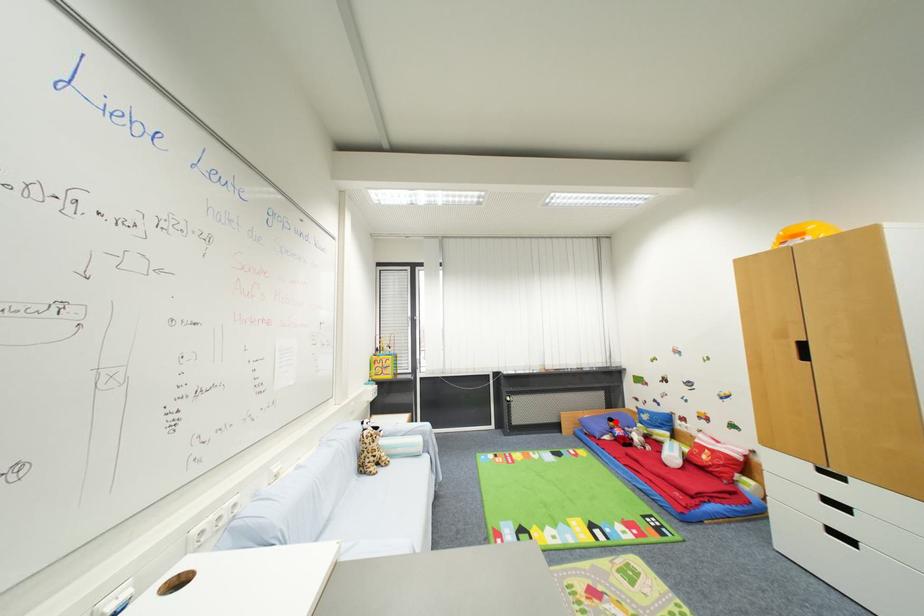
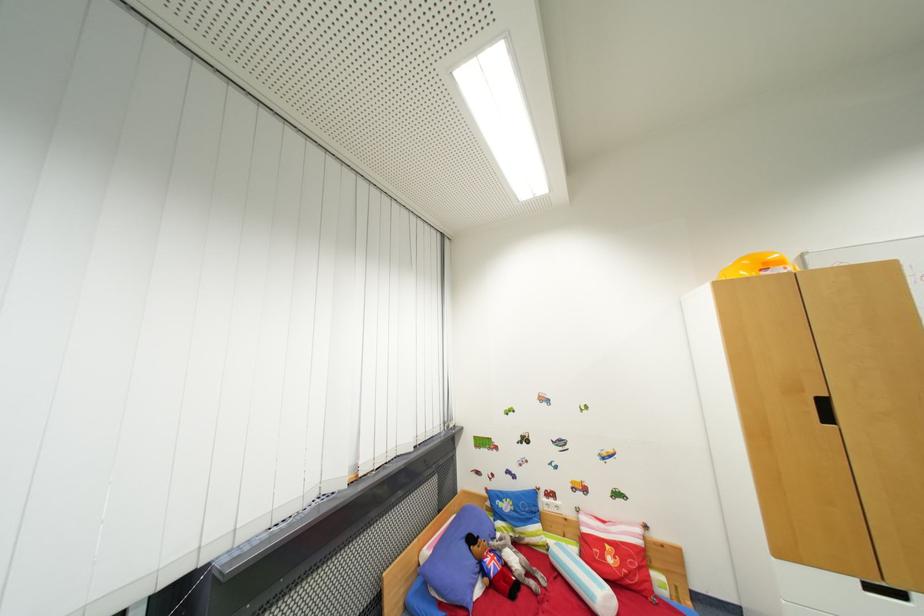
In the second image, find the point that corresponds to the highlighted location in the first image.

(477, 541)